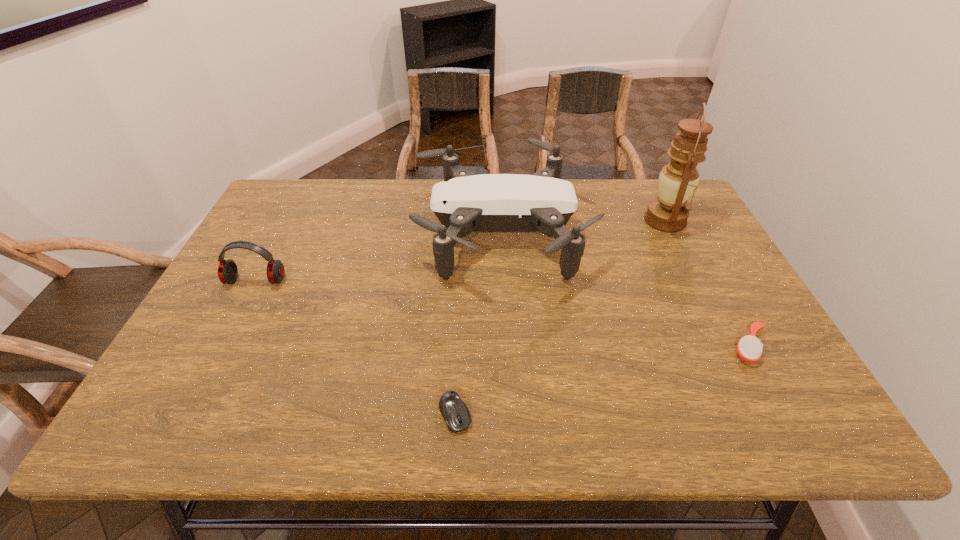
The height and width of the screenshot is (540, 960). In the image, there is a desktop. In order to click on vacant space at the far edge in this screenshot , I will do `click(335, 185)`.

You are a GUI agent. You are given a task and a screenshot of the screen. Output one action in this format:
    pyautogui.click(x=<x>, y=<y>)
    Task: Click on the free space at the near edge of the desktop
    This screenshot has height=540, width=960.
    Given the screenshot: What is the action you would take?
    pyautogui.click(x=554, y=410)

The image size is (960, 540). In the image, there is a desktop. What are the coordinates of `vacant space at the left edge` in the screenshot? It's located at (293, 239).

In the image, there is a desktop. Identify the location of free space at the right edge. The image size is (960, 540). (698, 286).

Locate an element on the screen. This screenshot has width=960, height=540. free space between the third shortest object and the nearest object is located at coordinates (355, 348).

Identify the location of free spot between the earphone and the tallest object. The image size is (960, 540). (461, 251).

Locate an element on the screen. free space that is in between the second tallest object and the hairbrush is located at coordinates (625, 289).

This screenshot has width=960, height=540. In order to click on free space between the mouse and the drone in this screenshot , I will do `click(477, 323)`.

At what (x,y) coordinates should I click in order to perform the action: click on free spot between the tallest object and the leftmost object. Please return your answer as a coordinate pair (x, y). Image resolution: width=960 pixels, height=540 pixels. Looking at the image, I should click on (461, 251).

Locate an element on the screen. The height and width of the screenshot is (540, 960). free space that is in between the earphone and the nearest object is located at coordinates (355, 348).